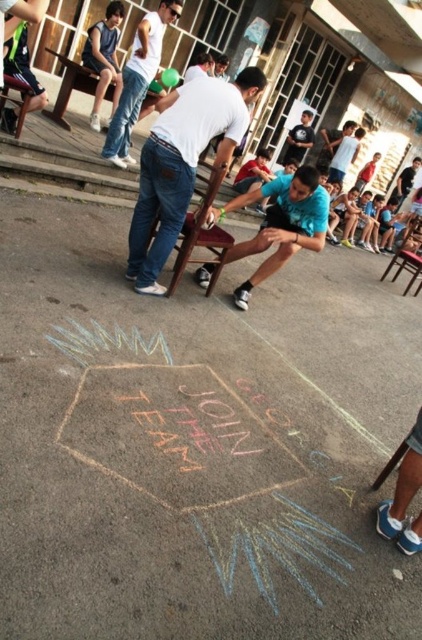
Question: Which object is the farthest from the chalk drawing at center?

Choices:
 (A) white t-shirt at upper center
 (B) white matte shirt at center
 (C) wooden chair at left
 (D) brown wooden chair at center

Answer: (A)

Question: Can you confirm if chalk drawing at center is positioned below wooden chair at right?

Choices:
 (A) no
 (B) yes

Answer: (B)

Question: Which point is closer to the camera?

Choices:
 (A) blue matte shirt at center
 (B) chalk drawing at center
 (C) brown wooden chair at center

Answer: (B)

Question: Does brown wooden chair at center appear on the right side of wooden chair at right?

Choices:
 (A) no
 (B) yes

Answer: (A)

Question: Does wooden chair at left appear over dark blue t-shirt at upper center?

Choices:
 (A) yes
 (B) no

Answer: (B)

Question: Which point is farther to the camera?

Choices:
 (A) (197, 150)
 (B) (113, 4)

Answer: (B)